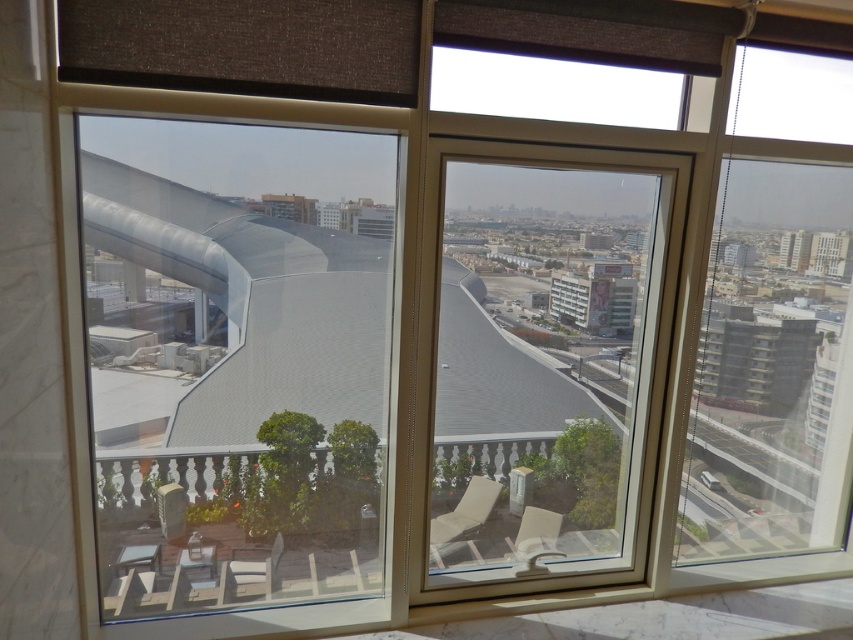
Measure the distance from matte white lounge chair at center to matte beige chair at lower right.

matte white lounge chair at center is 8.33 inches away from matte beige chair at lower right.

Is matte white lounge chair at center to the left of matte beige chair at lower right from the viewer's perspective?

Yes, matte white lounge chair at center is to the left of matte beige chair at lower right.

The width and height of the screenshot is (853, 640). I want to click on matte white lounge chair at center, so click(x=465, y=512).

Image resolution: width=853 pixels, height=640 pixels. I want to click on matte white lounge chair at center, so click(x=465, y=512).

Image resolution: width=853 pixels, height=640 pixels. Identify the location of matte white chair at center. (253, 573).

Between point (242, 572) and point (546, 547), which one is positioned in front?

Point (242, 572)

The width and height of the screenshot is (853, 640). Find the location of `matte white chair at center`. matte white chair at center is located at coordinates (253, 573).

You are a GUI agent. You are given a task and a screenshot of the screen. Output one action in this format:
    pyautogui.click(x=<x>, y=<y>)
    Task: Click on the matte white chair at center
    
    Given the screenshot: What is the action you would take?
    click(253, 573)

Between matte white lounge chair at center and matte white chair at center, which one has less height?

matte white chair at center is shorter.

Who is more forward, (437, 529) or (231, 595)?

Point (231, 595) is in front.

Which is behind, point (444, 538) or point (282, 547)?

Point (444, 538)

This screenshot has height=640, width=853. I want to click on matte white lounge chair at center, so click(x=465, y=512).